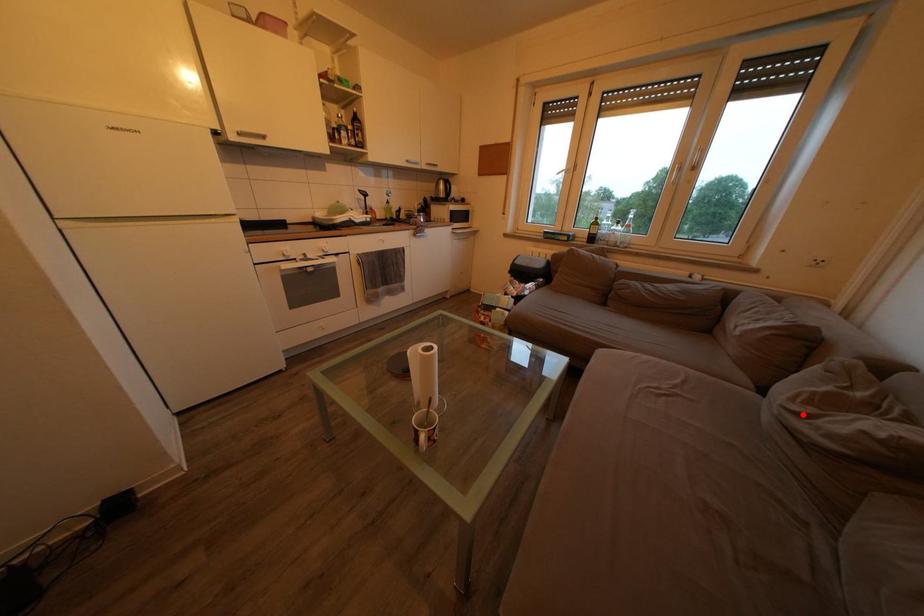
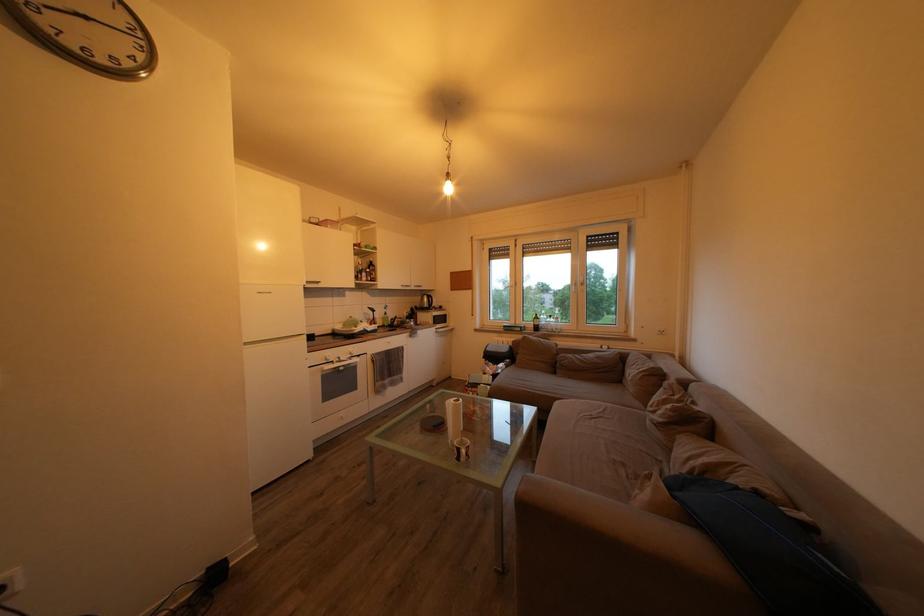
Where in the second image is the point corresponding to the highlighted location from the first image?

(659, 416)